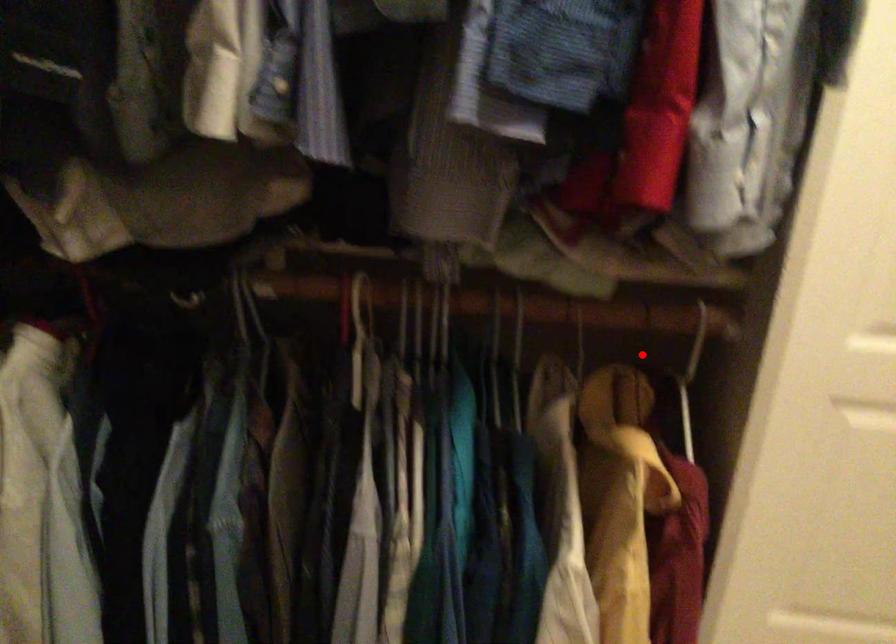
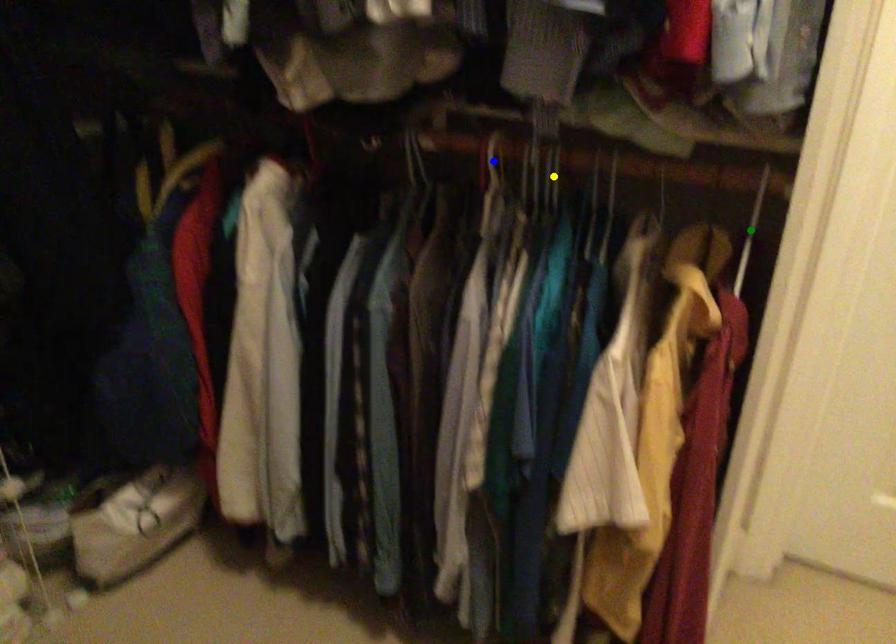
Question: I am providing you with two images of the same scene from different viewpoints. A red point is marked on the first image. You are given multiple points on the second image. Which spot in image 2 lines up with the point in image 1?

Choices:
 (A) green point
 (B) yellow point
 (C) blue point

Answer: (A)